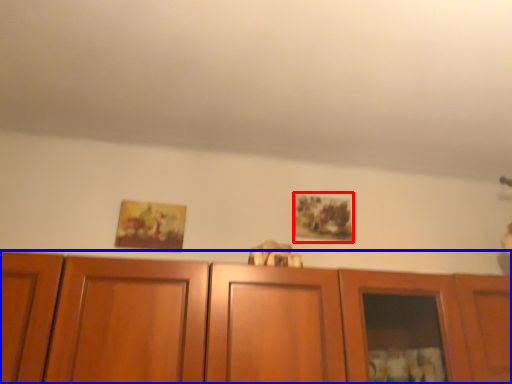
Question: Which point is further to the camera, picture frame (highlighted by a red box) or cabinetry (highlighted by a blue box)?

Choices:
 (A) picture frame
 (B) cabinetry

Answer: (A)